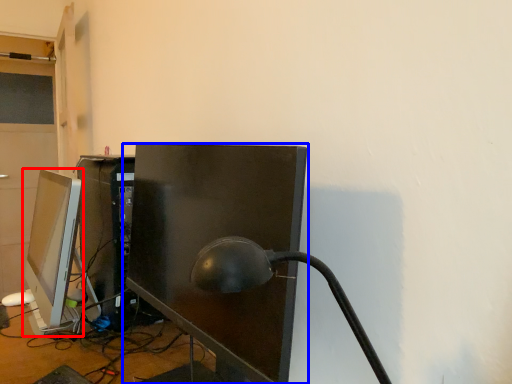
Question: Which of the following is the closest to the observer, computer monitor (highlighted by a red box) or computer monitor (highlighted by a blue box)?

Choices:
 (A) computer monitor
 (B) computer monitor

Answer: (B)